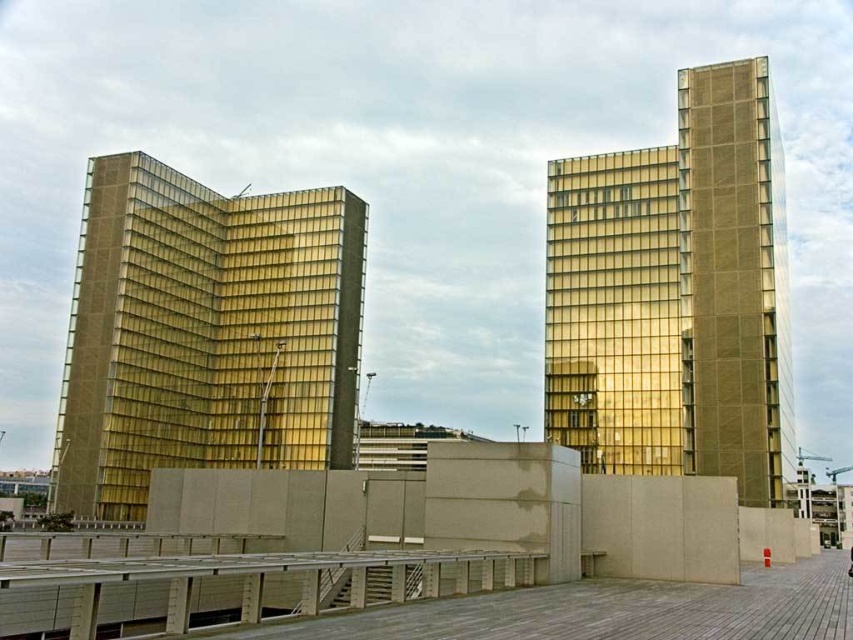
Question: Is gold glass building at left smaller than gold glass building at upper right?

Choices:
 (A) yes
 (B) no

Answer: (B)

Question: Does gold glass building at left appear on the left side of gold glass building at upper right?

Choices:
 (A) no
 (B) yes

Answer: (B)

Question: Considering the relative positions of gold glass building at left and gold glass building at upper right in the image provided, where is gold glass building at left located with respect to gold glass building at upper right?

Choices:
 (A) above
 (B) below

Answer: (B)

Question: Which object is farther from the camera taking this photo?

Choices:
 (A) gold glass building at upper right
 (B) gold glass building at left

Answer: (B)

Question: Which of the following is the closest to the observer?

Choices:
 (A) gold glass building at upper right
 (B) gold glass building at left

Answer: (A)